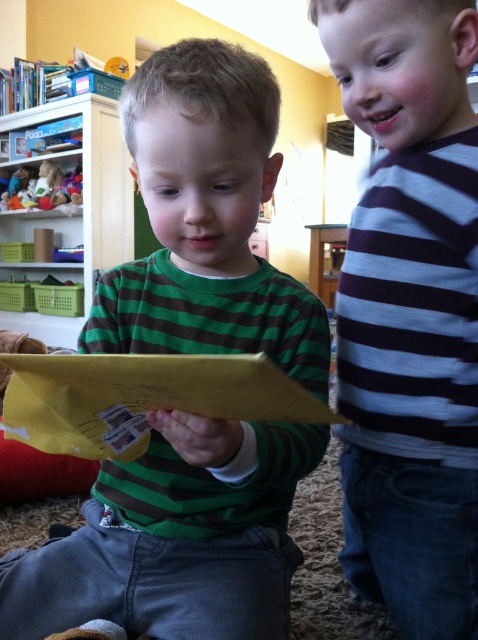
In the scene shown: Between wooden bookshelf at upper left and soft plush bear at upper left, which one appears on the right side from the viewer's perspective?

wooden bookshelf at upper left is more to the right.

Locate an element on the screen. wooden bookshelf at upper left is located at coordinates (82, 192).

Identify the location of wooden bookshelf at upper left. The image size is (478, 640). (82, 192).

Can you confirm if striped cotton shirt at right is shorter than soft plush bear at upper left?

In fact, striped cotton shirt at right may be taller than soft plush bear at upper left.

Between point (380, 480) and point (43, 186), which one is positioned in front?

Point (380, 480) is in front.

This screenshot has width=478, height=640. Find the location of `striped cotton shirt at right`. striped cotton shirt at right is located at coordinates (410, 310).

Between green striped shirt at center and soft plush bear at upper left, which one has less height?

With less height is soft plush bear at upper left.

Can you confirm if green striped shirt at center is bigger than soft plush bear at upper left?

Yes, green striped shirt at center is bigger than soft plush bear at upper left.

Is point (220, 518) in front of point (46, 180)?

That is True.

This screenshot has width=478, height=640. What are the coordinates of `green striped shirt at center` in the screenshot? It's located at (175, 538).